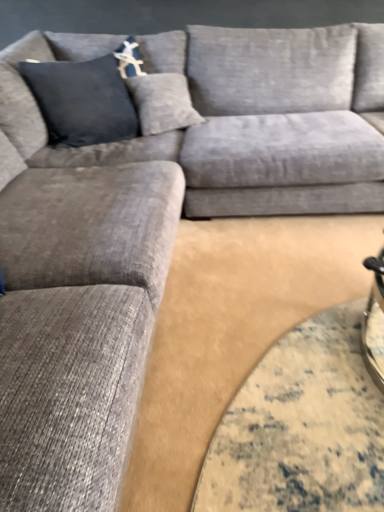
The image size is (384, 512). What do you see at coordinates (231, 115) in the screenshot?
I see `textured gray couch at center` at bounding box center [231, 115].

The width and height of the screenshot is (384, 512). Identify the location of textured gray couch at center. (231, 115).

Describe the element at coordinates (163, 52) in the screenshot. I see `dark blue fabric pillow at upper left` at that location.

Find the location of a particular element. This screenshot has height=512, width=384. dark blue fabric pillow at upper left is located at coordinates (163, 52).

Locate an element on the screen. The width and height of the screenshot is (384, 512). textured gray couch at center is located at coordinates (231, 115).

Between textured gray couch at center and dark blue fabric pillow at upper left, which one appears on the left side from the viewer's perspective?

dark blue fabric pillow at upper left is more to the left.

Considering the positions of objects textured gray couch at center and dark blue fabric pillow at upper left in the image provided, who is in front, textured gray couch at center or dark blue fabric pillow at upper left?

textured gray couch at center is closer to the camera.

Which is less distant, [146,92] or [61,54]?

Clearly, point [146,92] is closer to the camera than point [61,54].

From the image's perspective, does textured gray couch at center appear higher than dark blue fabric pillow at upper left?

No, from the image's perspective, textured gray couch at center is not on top of dark blue fabric pillow at upper left.

From a real-world perspective, is textured gray couch at center located higher than dark blue fabric pillow at upper left?

Actually, textured gray couch at center is physically below dark blue fabric pillow at upper left in the real world.

Between textured gray couch at center and dark blue fabric pillow at upper left, which one has smaller width?

Thinner between the two is dark blue fabric pillow at upper left.

From their relative heights in the image, would you say textured gray couch at center is taller or shorter than dark blue fabric pillow at upper left?

Clearly, textured gray couch at center is taller compared to dark blue fabric pillow at upper left.

Considering the relative sizes of textured gray couch at center and dark blue fabric pillow at upper left in the image provided, is textured gray couch at center bigger than dark blue fabric pillow at upper left?

Indeed, textured gray couch at center has a larger size compared to dark blue fabric pillow at upper left.

Could dark blue fabric pillow at upper left be considered to be inside textured gray couch at center?

No, dark blue fabric pillow at upper left is not surrounded by textured gray couch at center.

Can you see textured gray couch at center touching dark blue fabric pillow at upper left?

They are not placed beside each other.

Is textured gray couch at center oriented towards dark blue fabric pillow at upper left?

No, textured gray couch at center does not turn towards dark blue fabric pillow at upper left.

Consider the image. How different are the orientations of textured gray couch at center and dark blue fabric pillow at upper left in degrees?

13.6 degrees separate the facing orientations of textured gray couch at center and dark blue fabric pillow at upper left.

How far apart are textured gray couch at center and dark blue fabric pillow at upper left?

They are 18.49 inches apart.

Identify the location of pillow above the textured gray couch at center (from the image's perspective). The height and width of the screenshot is (512, 384). (163, 52).

Between dark blue fabric pillow at upper left and textured gray couch at center, which one appears on the right side from the viewer's perspective?

Positioned to the right is textured gray couch at center.

In the image, is dark blue fabric pillow at upper left positioned in front of or behind textured gray couch at center?

In the image, dark blue fabric pillow at upper left appears behind textured gray couch at center.

Which point is more distant from viewer, (170, 65) or (57, 163)?

The point (170, 65) is behind.

From the image's perspective, is dark blue fabric pillow at upper left on textured gray couch at center?

Indeed, from the image's perspective, dark blue fabric pillow at upper left is shown above textured gray couch at center.

From a real-world perspective, does dark blue fabric pillow at upper left stand above textured gray couch at center?

Yes, from a real-world perspective, dark blue fabric pillow at upper left is on top of textured gray couch at center.

Is dark blue fabric pillow at upper left thinner than textured gray couch at center?

Indeed, dark blue fabric pillow at upper left has a lesser width compared to textured gray couch at center.

Which of these two, dark blue fabric pillow at upper left or textured gray couch at center, stands shorter?

dark blue fabric pillow at upper left.

Does dark blue fabric pillow at upper left have a larger size compared to textured gray couch at center?

Actually, dark blue fabric pillow at upper left might be smaller than textured gray couch at center.

Is dark blue fabric pillow at upper left not inside textured gray couch at center?

Indeed, dark blue fabric pillow at upper left is completely outside textured gray couch at center.

Is the surface of dark blue fabric pillow at upper left in direct contact with textured gray couch at center?

dark blue fabric pillow at upper left and textured gray couch at center are not in contact.

Consider the image. Is dark blue fabric pillow at upper left aimed at textured gray couch at center?

No, dark blue fabric pillow at upper left is not facing towards textured gray couch at center.

How many degrees apart are the facing directions of dark blue fabric pillow at upper left and textured gray couch at center?

There is a 13.6-degree angle between the facing directions of dark blue fabric pillow at upper left and textured gray couch at center.

Locate an element on the screen. The height and width of the screenshot is (512, 384). pillow located above the textured gray couch at center (from the image's perspective) is located at coordinates (163, 52).

Where is `pillow lying above the textured gray couch at center (from the image's perspective)`? The image size is (384, 512). pillow lying above the textured gray couch at center (from the image's perspective) is located at coordinates (163, 52).

The height and width of the screenshot is (512, 384). Find the location of `pillow behind the textured gray couch at center`. pillow behind the textured gray couch at center is located at coordinates (163, 52).